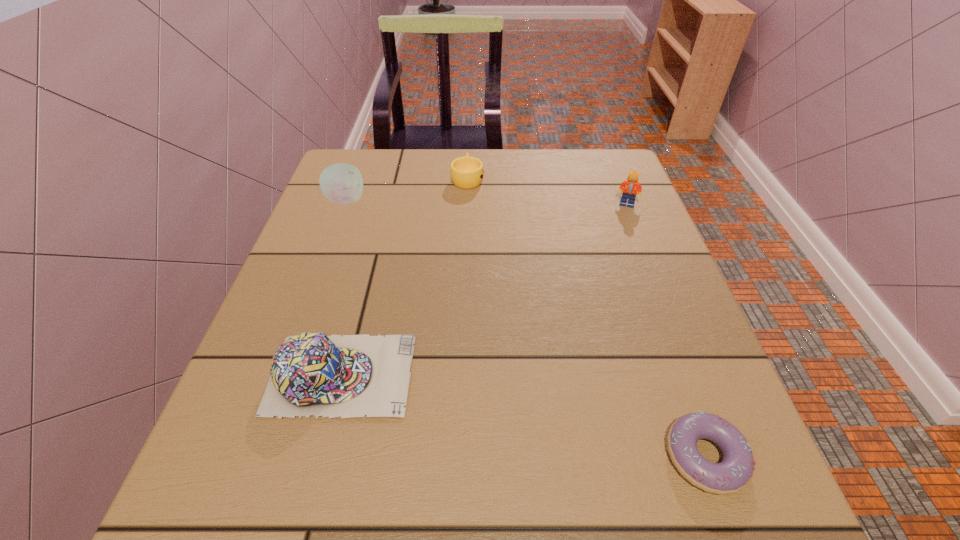
Image resolution: width=960 pixels, height=540 pixels. In order to click on vacant position located 0.060m on the left of the doughnut in this screenshot , I will do `click(623, 457)`.

Where is `apple at the far edge`? Image resolution: width=960 pixels, height=540 pixels. apple at the far edge is located at coordinates [x=342, y=183].

The height and width of the screenshot is (540, 960). Identify the location of cup that is at the far edge. tap(467, 172).

This screenshot has height=540, width=960. What are the coordinates of `object at the near edge` in the screenshot? It's located at (735, 471).

Locate an element on the screen. This screenshot has width=960, height=540. apple at the left edge is located at coordinates (342, 183).

This screenshot has height=540, width=960. In order to click on cap that is positioned at the left edge in this screenshot , I will do click(311, 374).

Where is `Lego that is at the right edge`? The image size is (960, 540). Lego that is at the right edge is located at coordinates 630,186.

At what (x,y) coordinates should I click in order to perform the action: click on doughnut that is at the right edge. Please return your answer as a coordinate pair (x, y). Looking at the image, I should click on (735, 471).

Identify the location of object located at the far left corner. (342, 183).

Identify the location of object situated at the near right corner. Image resolution: width=960 pixels, height=540 pixels. (735, 471).